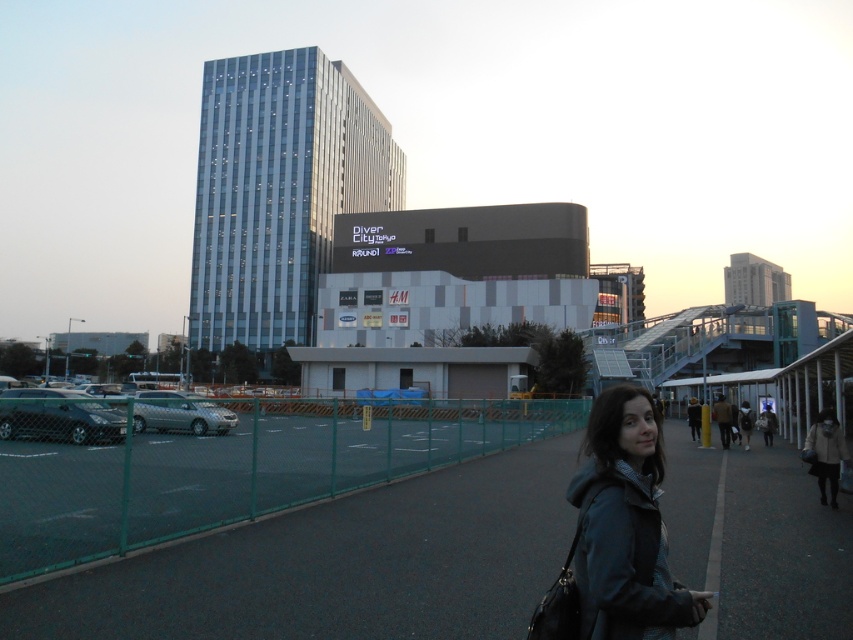
Question: Which of the following is the farthest from the observer?

Choices:
 (A) (622, 390)
 (B) (763, 262)
 (C) (293, 136)
 (D) (537, 448)

Answer: (B)

Question: Which point is farther to the camera?

Choices:
 (A) white glass building at upper right
 (B) glassy metallic skyscraper at center-left
 (C) dark blue jacket at center
 (D) dark asphalt pavement at lower center

Answer: (A)

Question: Is dark asphalt pavement at lower center below dark blue jacket at center?

Choices:
 (A) yes
 (B) no

Answer: (A)

Question: Which point appears farthest from the camera in this image?

Choices:
 (A) (256, 109)
 (B) (756, 268)
 (C) (537, 545)

Answer: (B)

Question: Is dark asphalt pavement at lower center thinner than glassy metallic skyscraper at center-left?

Choices:
 (A) no
 (B) yes

Answer: (B)

Question: Is dark blue jacket at center wider than white glass building at upper right?

Choices:
 (A) no
 (B) yes

Answer: (A)